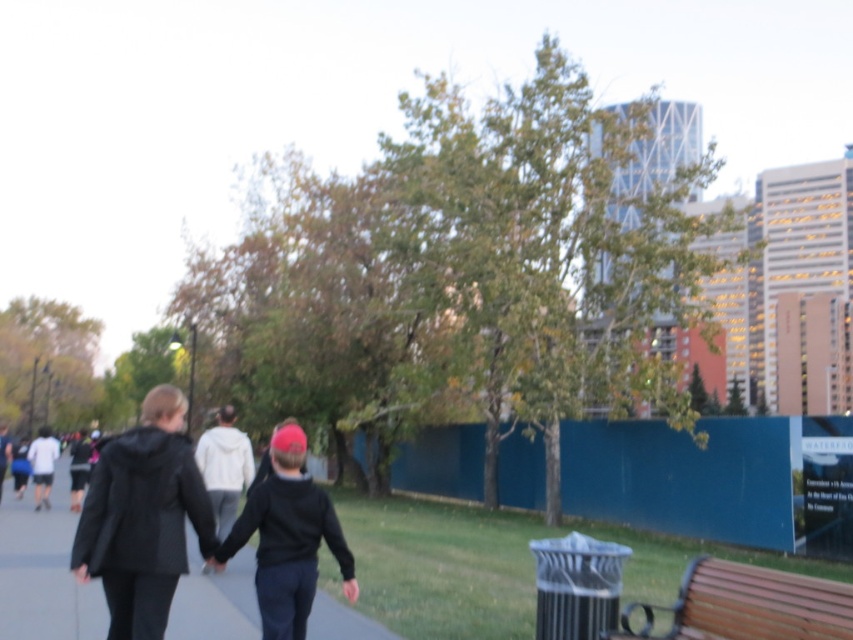
You are standing at the point marked as point [288,538] in the image. Looking around, you see a black matte jacket at center. What object is located at your current position?

The point [288,538] corresponds to the black matte jacket at center.

You are a photographer trying to capture both the black matte jacket at center and the brown wooden bench at lower right in the same frame. Based on their sizes in the image, which object should you focus on first to ensure both are in focus?

The black matte jacket at center is taller than the brown wooden bench at lower right, so focusing on the black matte jacket at center first will help ensure both are in focus as it is the larger object in the frame.

You are a photographer standing at the park entrance. You want to take a photo of the black matte jacket at center and the brown wooden bench at lower right in the same frame. The minimum distance between the objects to ensure both are in focus is 10 feet. Can you capture both in focus from your current position?

The black matte jacket at center is 8.71 feet away from the brown wooden bench at lower right. Since the minimum required distance for both to be in focus is 10 feet, you cannot capture both in focus from your current position.